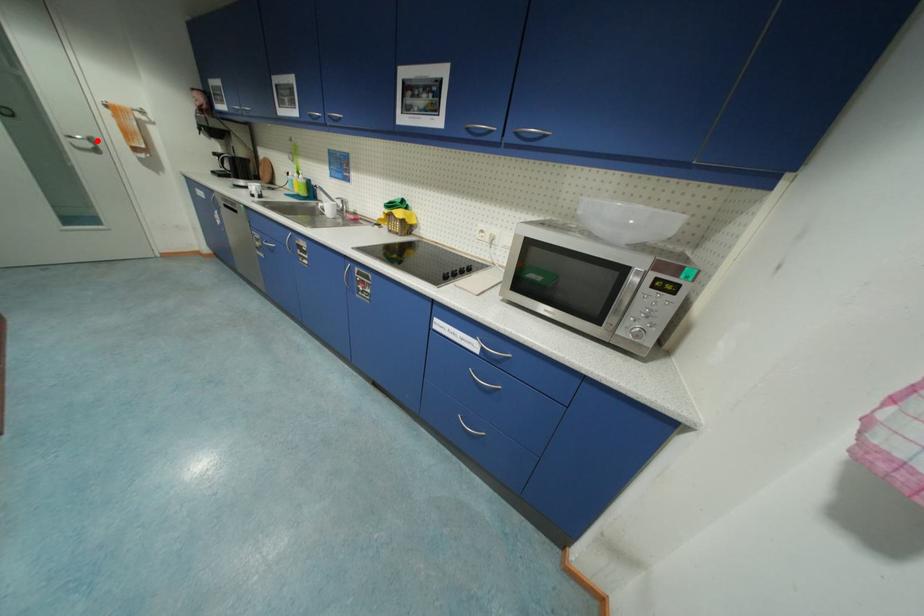
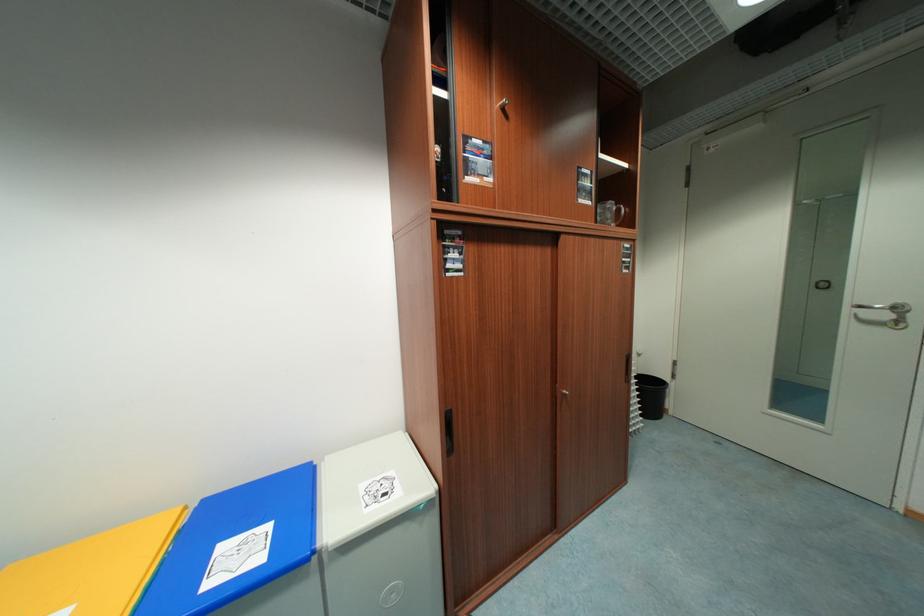
Find the pixel in the second image that matches the highlighted location in the first image.

(904, 310)